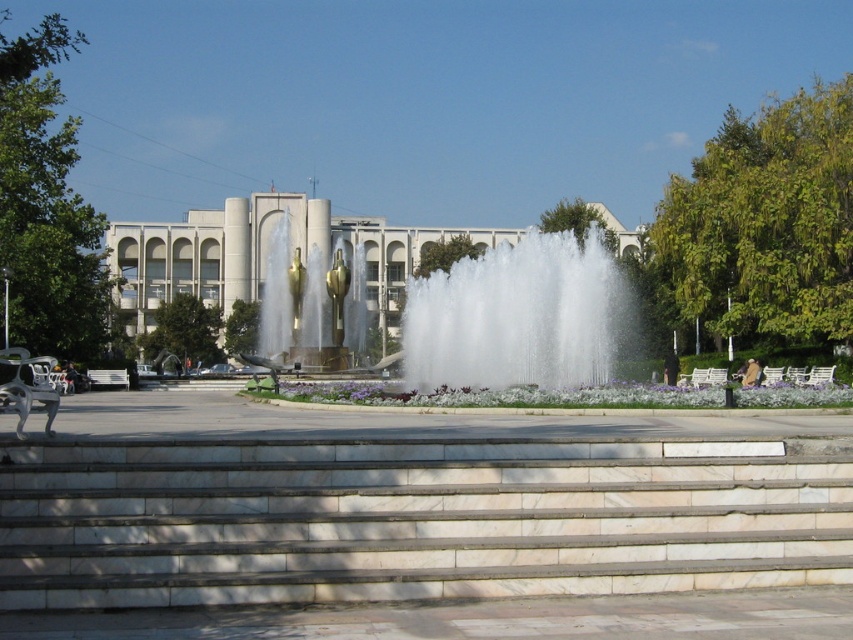
Question: Can you confirm if white marble stairs at center is positioned to the left of gold polished water at center?

Choices:
 (A) yes
 (B) no

Answer: (B)

Question: Which point is farther from the camera taking this photo?

Choices:
 (A) 256,364
 (B) 520,246

Answer: (A)

Question: Where is white marble stairs at center located in relation to white frothy water at center in the image?

Choices:
 (A) below
 (B) above

Answer: (A)

Question: Considering the relative positions of white marble stairs at center and white frothy water at center in the image provided, where is white marble stairs at center located with respect to white frothy water at center?

Choices:
 (A) below
 (B) above

Answer: (A)

Question: Which is farther from the white marble stairs at center?

Choices:
 (A) white frothy water at center
 (B) gold polished water at center

Answer: (B)

Question: Which is nearer to the white marble stairs at center?

Choices:
 (A) white frothy water at center
 (B) gold polished water at center

Answer: (A)